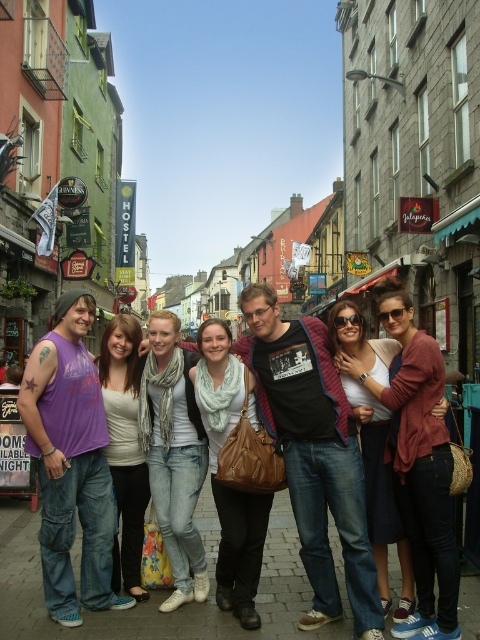
You are a photographer standing at the back of the group. You want to capture a photo of the light blue denim jeans at center and the light beige scarf at center in the same frame. Given that your camera has a minimum focus distance of 3 feet, will you be able to take the photo without moving closer?

The distance between the light blue denim jeans at center and the light beige scarf at center is 38.08 inches, which is approximately 3.17 feet. Since the minimum focus distance is 3 feet, the camera can focus on both objects as the distance is slightly more than required. Therefore, you can take the photo without moving closer.

You are a photographer trying to capture the group in the foreground. You notice the denim skirt at center and the light beige scarf at center. Which object should you adjust your focus to ensure both are clearly visible, considering their sizes?

The denim skirt at center occupies less space than the light beige scarf at center, so you should focus on the denim skirt at center to ensure both are clearly visible since it is smaller and requires more precise focus.

You are a photographer trying to capture the group of seven people in the scene. You want to ensure that both the light blue denim jeans at center and the light beige scarf at center are visible in your shot. Based on their positions, which object should you focus on first to frame them properly?

The light beige scarf at center is to the left of the light blue denim jeans at center, so focusing on the light beige scarf at center first would allow you to frame both objects properly in the shot.